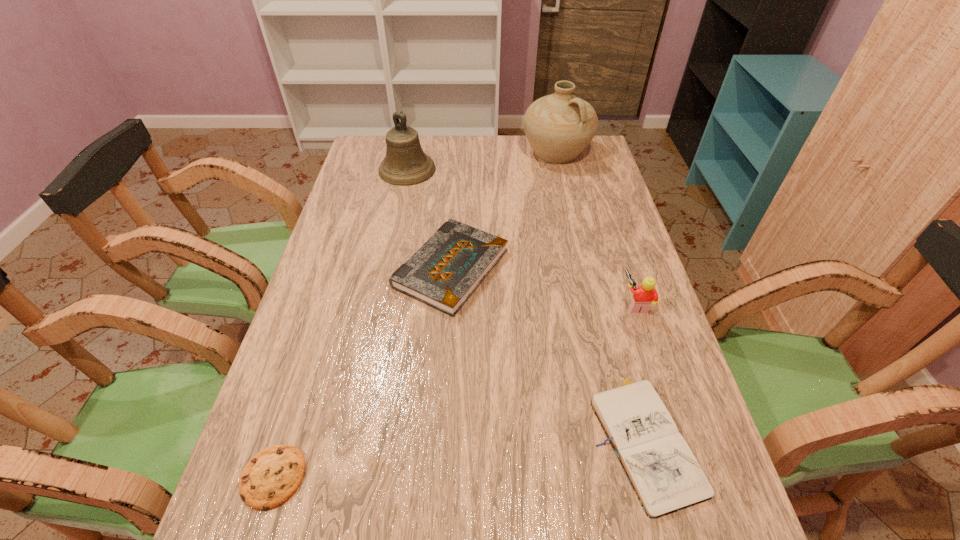
This screenshot has height=540, width=960. In order to click on vacant space situated 0.220m in front of the Lego with the accessory visible in this screenshot , I will do `click(535, 304)`.

You are a GUI agent. You are given a task and a screenshot of the screen. Output one action in this format:
    pyautogui.click(x=<x>, y=<y>)
    Task: Click on the free space located 0.060m in front of the Lego with the accessory visible
    This screenshot has width=960, height=540.
    Given the screenshot: What is the action you would take?
    pyautogui.click(x=598, y=304)

Locate an element on the screen. The image size is (960, 540). free region located 0.140m in front of the Lego with the accessory visible is located at coordinates (x=566, y=304).

Where is `vacant space located on the back of the taller notebook`? The width and height of the screenshot is (960, 540). vacant space located on the back of the taller notebook is located at coordinates (457, 174).

Locate an element on the screen. vacant area situated on the left of the nearer notebook is located at coordinates (463, 437).

Locate an element on the screen. free spot located 0.080m on the right of the cookie is located at coordinates (348, 477).

You are a GUI agent. You are given a task and a screenshot of the screen. Output one action in this format:
    pyautogui.click(x=<x>, y=<y>)
    Task: Click on the pottery that is at the far edge
    
    Given the screenshot: What is the action you would take?
    pyautogui.click(x=559, y=126)

Find the location of a particular element. bell that is at the far edge is located at coordinates (405, 163).

The image size is (960, 540). In order to click on bell that is at the left edge in this screenshot , I will do (x=405, y=163).

Locate an element on the screen. This screenshot has height=540, width=960. cookie that is at the left edge is located at coordinates (272, 476).